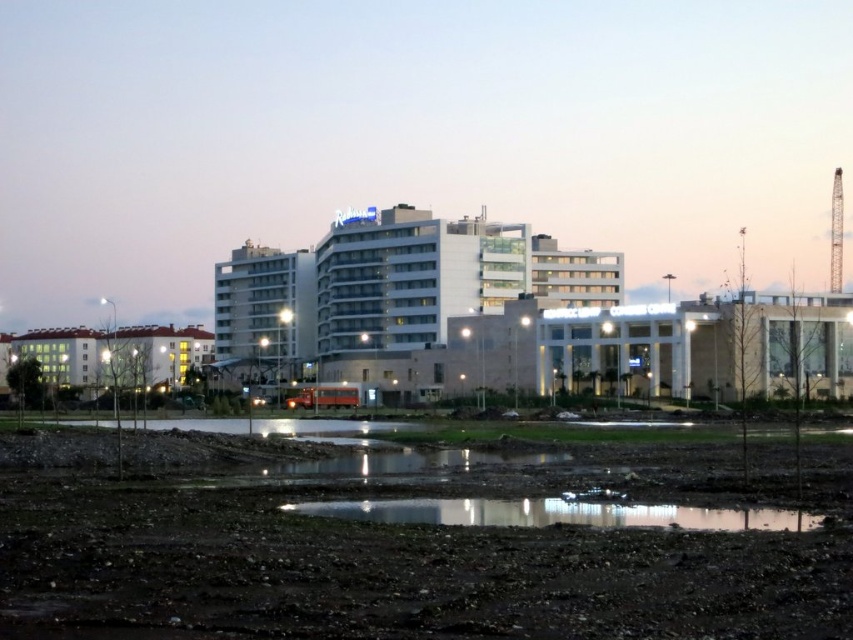
Is white glass building at center to the left of glossy concrete puddle at lower center from the viewer's perspective?

Correct, you'll find white glass building at center to the left of glossy concrete puddle at lower center.

Which of these two, white glass building at center or glossy concrete puddle at lower center, stands taller?

white glass building at center

Identify the location of white glass building at center. This screenshot has width=853, height=640. (389, 292).

Does white glass building at center have a greater width compared to white matte building at lower left?

No, white glass building at center is not wider than white matte building at lower left.

Can you confirm if white glass building at center is shorter than white matte building at lower left?

No, white glass building at center is not shorter than white matte building at lower left.

Is point (409, 356) positioned after point (33, 332)?

No, (409, 356) is in front of (33, 332).

I want to click on white glass building at center, so click(389, 292).

The image size is (853, 640). What do you see at coordinates (556, 513) in the screenshot?
I see `glossy concrete puddle at lower center` at bounding box center [556, 513].

Is glossy concrete puddle at lower center below white matte building at lower left?

Correct, glossy concrete puddle at lower center is located below white matte building at lower left.

Between point (700, 516) and point (160, 356), which one is positioned behind?

Positioned behind is point (160, 356).

You are a GUI agent. You are given a task and a screenshot of the screen. Output one action in this format:
    pyautogui.click(x=<x>, y=<y>)
    Task: Click on the glossy concrete puddle at lower center
    The width and height of the screenshot is (853, 640).
    Given the screenshot: What is the action you would take?
    pyautogui.click(x=556, y=513)